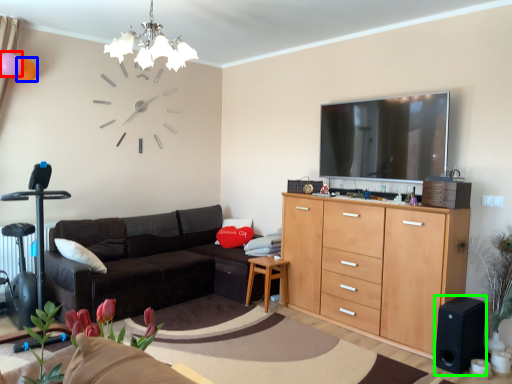
Question: Which is farther away from balloon (highlighted by a red box)? balloon (highlighted by a blue box) or speaker (highlighted by a green box)?

Choices:
 (A) balloon
 (B) speaker

Answer: (B)